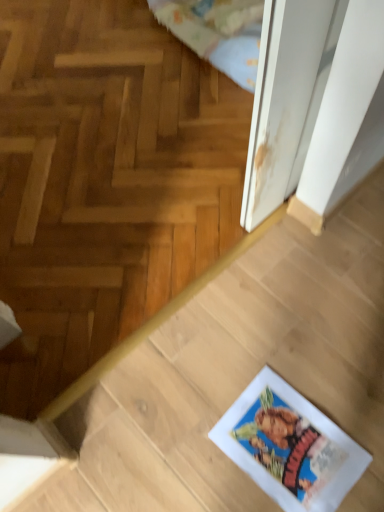
Image resolution: width=384 pixels, height=512 pixels. Find the location of `white paper postcard at lower right`. white paper postcard at lower right is located at coordinates (289, 446).

What do you see at coordinates (289, 446) in the screenshot? I see `white paper postcard at lower right` at bounding box center [289, 446].

I want to click on white paper postcard at lower right, so click(x=289, y=446).